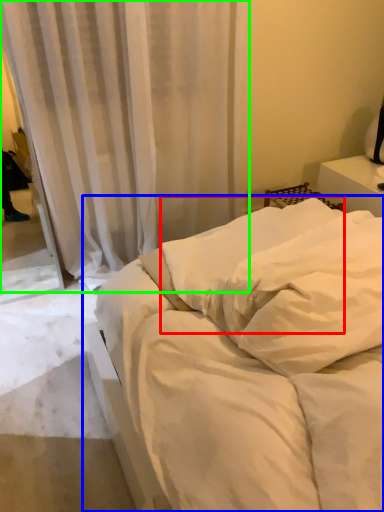
Question: Estimate the real-world distances between objects in this image. Which object is closer to pillow (highlighted by a red box), bed (highlighted by a blue box) or curtain (highlighted by a green box)?

Choices:
 (A) bed
 (B) curtain

Answer: (A)